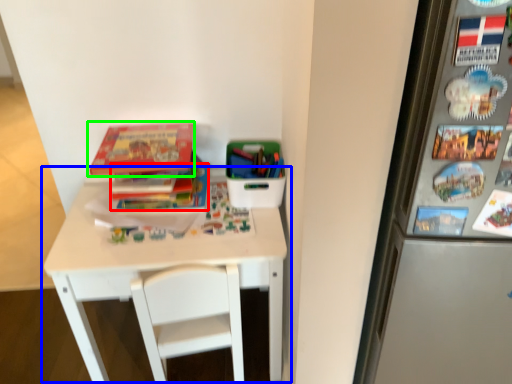
Question: Based on their relative distances, which object is nearer to book (highlighted by a red box)? Choose from table (highlighted by a blue box) and book (highlighted by a green box).

Choices:
 (A) table
 (B) book

Answer: (B)